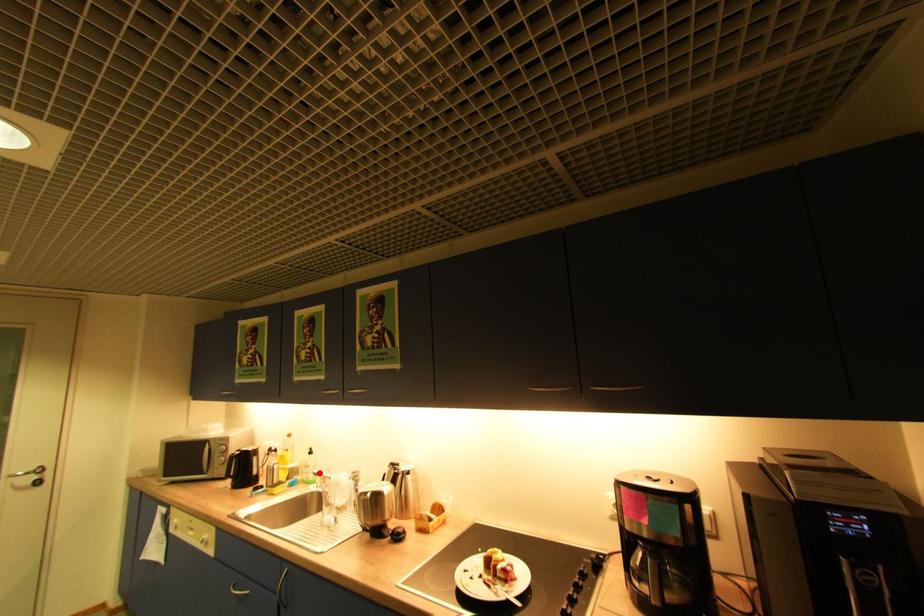
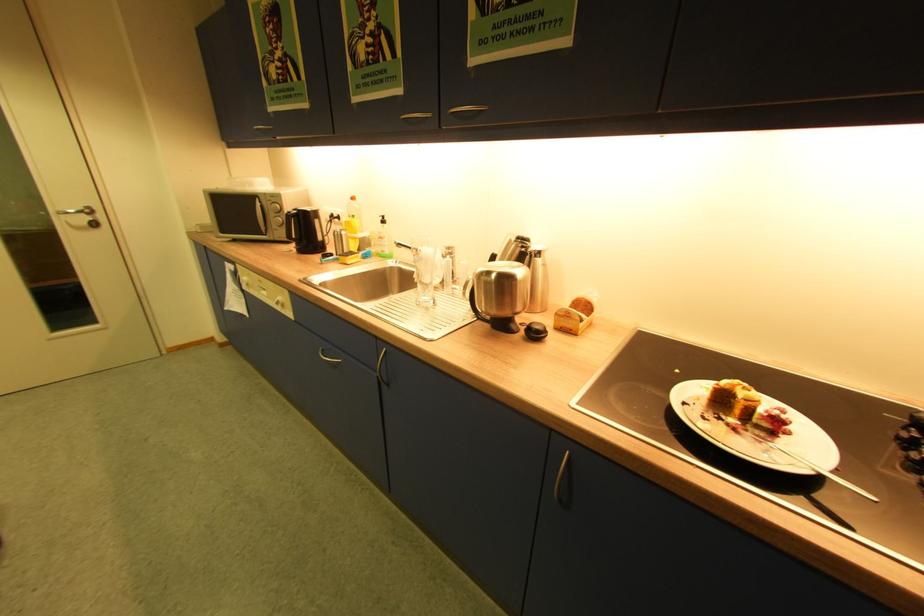
Where in the second image is the point corresponding to the highlighted location from the first image?

(400, 243)